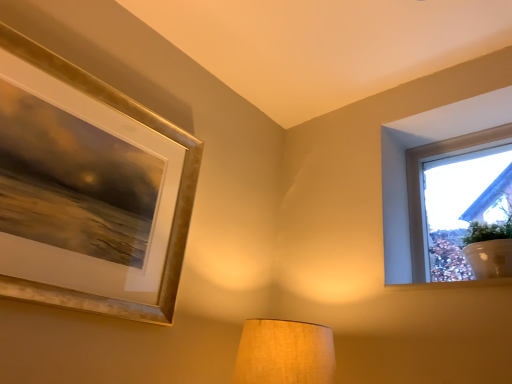
What is the approximate height of transparent glass window at upper right?

transparent glass window at upper right is 15.84 inches in height.

Image resolution: width=512 pixels, height=384 pixels. What do you see at coordinates (451, 284) in the screenshot?
I see `white painted wood at upper right` at bounding box center [451, 284].

At what (x,y) coordinates should I click in order to perform the action: click on gold metallic picture frame at upper left. Please return your answer as a coordinate pair (x, y). Looking at the image, I should click on click(175, 204).

Find the location of a particular element. matte beige lampshade at center is located at coordinates (284, 353).

Find the location of a particular element. transparent glass window at upper right is located at coordinates (463, 205).

How much distance is there between transparent glass window at upper right and matte beige lampshade at center?

transparent glass window at upper right and matte beige lampshade at center are 78.75 centimeters apart.

Is transparent glass window at upper right bigger than matte beige lampshade at center?

Yes, transparent glass window at upper right is bigger than matte beige lampshade at center.

Is matte beige lampshade at center at the back of transparent glass window at upper right?

That's not correct — transparent glass window at upper right is not looking away from matte beige lampshade at center.

Which is less distant, (509,145) or (307,378)?

Clearly, point (509,145) is more distant from the camera than point (307,378).

Based on their sizes in the image, would you say gold metallic picture frame at upper left is bigger or smaller than transparent glass window at upper right?

gold metallic picture frame at upper left is smaller than transparent glass window at upper right.

Is gold metallic picture frame at upper left facing towards transparent glass window at upper right?

No, gold metallic picture frame at upper left is not facing towards transparent glass window at upper right.

From the image's perspective, which is below, gold metallic picture frame at upper left or transparent glass window at upper right?

transparent glass window at upper right is shown below in the image.

What's the angular difference between gold metallic picture frame at upper left and transparent glass window at upper right's facing directions?

There is a 87.9-degree angle between the facing directions of gold metallic picture frame at upper left and transparent glass window at upper right.

Between white painted wood at upper right and gold metallic picture frame at upper left, which one appears on the left side from the viewer's perspective?

From the viewer's perspective, gold metallic picture frame at upper left appears more on the left side.

Which point is more forward, [428,284] or [159,320]?

The point [159,320] is in front.

Based on their sizes in the image, would you say white painted wood at upper right is bigger or smaller than gold metallic picture frame at upper left?

white painted wood at upper right is smaller than gold metallic picture frame at upper left.

Is white painted wood at upper right not close to gold metallic picture frame at upper left?

They are positioned close to each other.

Where is `picture frame in front of the matte beige lampshade at center`? The width and height of the screenshot is (512, 384). picture frame in front of the matte beige lampshade at center is located at coordinates (175, 204).

Is gold metallic picture frame at upper left directly adjacent to matte beige lampshade at center?

No, gold metallic picture frame at upper left is not with matte beige lampshade at center.

Is gold metallic picture frame at upper left aimed at matte beige lampshade at center?

No, gold metallic picture frame at upper left is not oriented towards matte beige lampshade at center.

Which of these two, gold metallic picture frame at upper left or matte beige lampshade at center, stands taller?

gold metallic picture frame at upper left.

In the image, there is a transparent glass window at upper right. Where is `window sill below it (from a real-world perspective)`? Image resolution: width=512 pixels, height=384 pixels. window sill below it (from a real-world perspective) is located at coordinates [x=451, y=284].

Is white painted wood at upper right a part of transparent glass window at upper right?

That's incorrect, white painted wood at upper right is not inside transparent glass window at upper right.

Between transparent glass window at upper right and white painted wood at upper right, which one has smaller size?

white painted wood at upper right.

Which is behind, point (468, 207) or point (440, 287)?

The point (468, 207) is more distant.

Locate an element on the screen. window sill beneath the transparent glass window at upper right (from a real-world perspective) is located at coordinates (451, 284).

Is white painted wood at upper right shorter than transparent glass window at upper right?

Yes.

Based on the photo, from the image's perspective, is white painted wood at upper right located above or below transparent glass window at upper right?

Based on their image positions, white painted wood at upper right is located beneath transparent glass window at upper right.

Is white painted wood at upper right touching transparent glass window at upper right?

No, white painted wood at upper right is not making contact with transparent glass window at upper right.

Is matte beige lampshade at center inside or outside of white painted wood at upper right?

matte beige lampshade at center is not inside white painted wood at upper right, it's outside.

Does point (253, 326) appear closer or farther from the camera than point (408, 288)?

Point (253, 326).

Can you tell me how much matte beige lampshade at center and white painted wood at upper right differ in facing direction?

The angular difference between matte beige lampshade at center and white painted wood at upper right is 89.7 degrees.

Can you confirm if matte beige lampshade at center is positioned to the right of white painted wood at upper right?

In fact, matte beige lampshade at center is to the left of white painted wood at upper right.

Find the location of a particular element. The image size is (512, 384). lamp below the transparent glass window at upper right (from the image's perspective) is located at coordinates (284, 353).

Find the location of a particular element. The width and height of the screenshot is (512, 384). window screen lying behind the gold metallic picture frame at upper left is located at coordinates (463, 205).

Estimate the real-world distances between objects in this image. Which object is further from gold metallic picture frame at upper left, transparent glass window at upper right or white painted wood at upper right?

transparent glass window at upper right.

From the image, which object appears to be nearer to white painted wood at upper right, transparent glass window at upper right or matte beige lampshade at center?

transparent glass window at upper right.

Based on their spatial positions, is matte beige lampshade at center or white painted wood at upper right closer to gold metallic picture frame at upper left?

Among the two, matte beige lampshade at center is located nearer to gold metallic picture frame at upper left.

Based on their spatial positions, is matte beige lampshade at center or gold metallic picture frame at upper left further from white painted wood at upper right?

gold metallic picture frame at upper left is positioned further to the anchor white painted wood at upper right.

From the picture: Looking at the image, which one is located closer to white painted wood at upper right, gold metallic picture frame at upper left or transparent glass window at upper right?

transparent glass window at upper right is positioned closer to the anchor white painted wood at upper right.

When comparing their distances from transparent glass window at upper right, does gold metallic picture frame at upper left or matte beige lampshade at center seem further?

gold metallic picture frame at upper left is positioned further to the anchor transparent glass window at upper right.

From the image, which object appears to be nearer to transparent glass window at upper right, gold metallic picture frame at upper left or white painted wood at upper right?

The object closer to transparent glass window at upper right is white painted wood at upper right.

Considering their positions, is transparent glass window at upper right positioned closer to matte beige lampshade at center than gold metallic picture frame at upper left?

gold metallic picture frame at upper left.

At what (x,y) coordinates should I click in order to perform the action: click on window sill between matte beige lampshade at center and transparent glass window at upper right in the horizontal direction. Please return your answer as a coordinate pair (x, y). The height and width of the screenshot is (384, 512). Looking at the image, I should click on (451, 284).

Identify the location of window sill located between gold metallic picture frame at upper left and transparent glass window at upper right in the left-right direction. (451, 284).

In order to click on lamp located between gold metallic picture frame at upper left and white painted wood at upper right in the left-right direction in this screenshot , I will do `click(284, 353)`.

I want to click on lamp between gold metallic picture frame at upper left and transparent glass window at upper right in the horizontal direction, so click(284, 353).